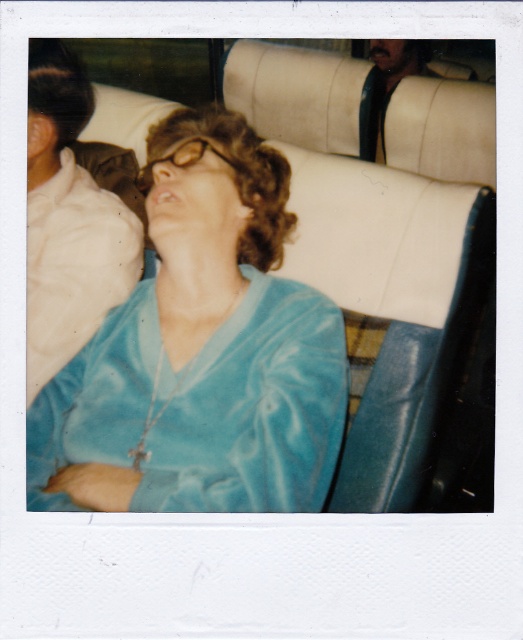
You are a photographer trying to capture a closeup of the velvet blue blouse at center and the satin blue robe at center in the Polaroid image. Which item should you focus on if you want to ensure the wider one is in sharp focus?

The velvet blue blouse at center is wider than the satin blue robe at center, so you should focus on the velvet blue blouse at center to ensure the wider item is in sharp focus.

You are a passenger on a train and notice two items in the photo. You see a satin blue robe at center and a leather at upper right. Which item is nearer to you?

The satin blue robe at center is closer to the viewer than the leather at upper right.